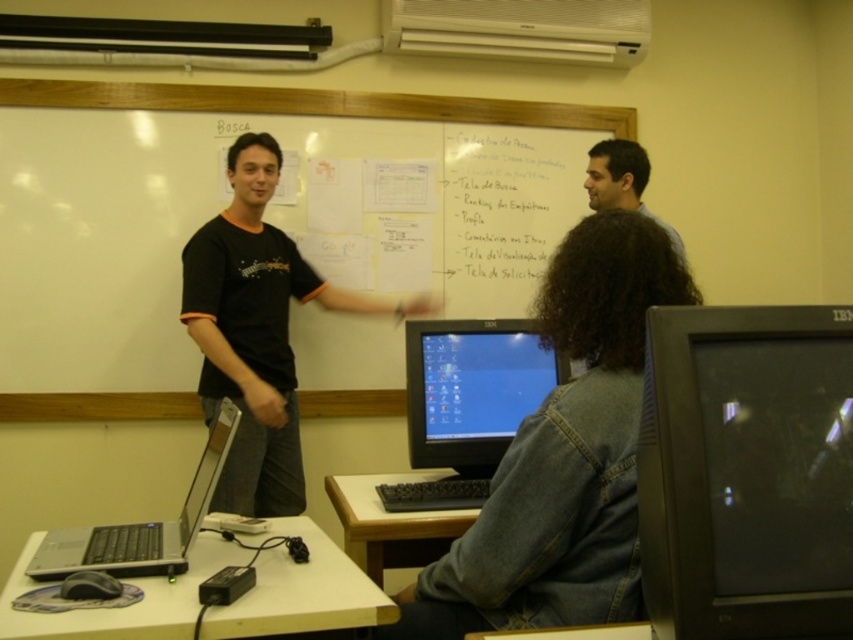
Which of these two, black glossy monitor at lower right or wooden table at lower center, stands taller?

With more height is black glossy monitor at lower right.

Is point (737, 614) closer to viewer compared to point (381, 561)?

Yes, it is in front of point (381, 561).

This screenshot has width=853, height=640. Identify the location of black glossy monitor at lower right. (746, 472).

Is point (90, 538) closer to camera compared to point (328, 477)?

Yes.

Find the location of `silver/black plastic laptop at lower left`. silver/black plastic laptop at lower left is located at coordinates (140, 525).

At what (x,y) coordinates should I click in order to perform the action: click on silver/black plastic laptop at lower left. Please return your answer as a coordinate pair (x, y). This screenshot has height=640, width=853. Looking at the image, I should click on (140, 525).

Is black t-shirt at center thinner than white plastic table at lower left?

Indeed, black t-shirt at center has a lesser width compared to white plastic table at lower left.

Which is above, black t-shirt at center or white plastic table at lower left?

black t-shirt at center is above.

Is point (189, 273) positioned behind point (105, 628)?

Yes.

Where is `black t-shirt at center`? Image resolution: width=853 pixels, height=640 pixels. black t-shirt at center is located at coordinates (257, 332).